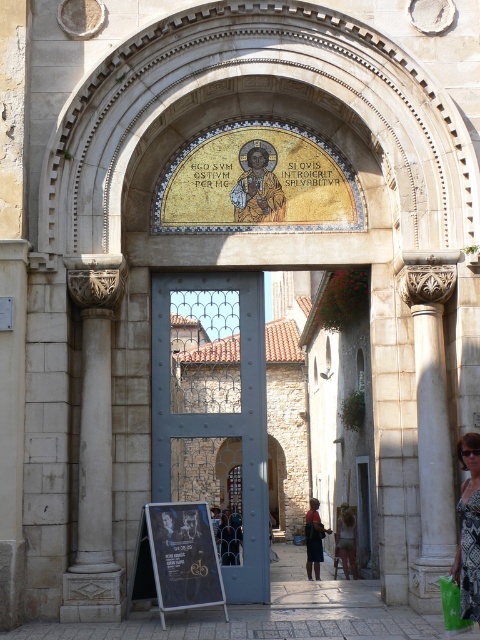
Question: Which of the following is the farthest from the observer?

Choices:
 (A) green plastic shopping bag at lower right
 (B) white stone column at left

Answer: (B)

Question: Does black chalkboard at lower center appear under light brown fabric dress at center?

Choices:
 (A) yes
 (B) no

Answer: (B)

Question: Is white stone column at left thinner than black chalkboard at lower center?

Choices:
 (A) no
 (B) yes

Answer: (B)

Question: Which is farther from the white stone column at left?

Choices:
 (A) black chalkboard at lower center
 (B) blue metallic door at center
 (C) gold mosaic figure at upper center
 (D) dark brown leather bag at center

Answer: (D)

Question: Which of the following is the closest to the observer?

Choices:
 (A) (319, 563)
 (B) (444, 612)

Answer: (B)

Question: Can you confirm if white stone column at left is positioned above green plastic shopping bag at lower right?

Choices:
 (A) no
 (B) yes

Answer: (B)